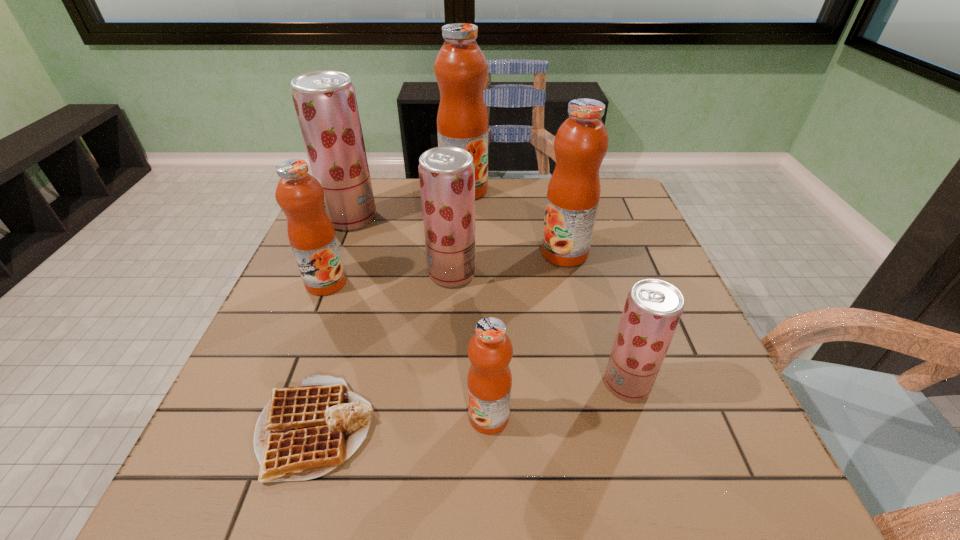
Where is `vacant region located on the front label of the third farthest orange fruit juice`? Image resolution: width=960 pixels, height=540 pixels. vacant region located on the front label of the third farthest orange fruit juice is located at coordinates (313, 316).

You are a GUI agent. You are given a task and a screenshot of the screen. Output one action in this format:
    pyautogui.click(x=<x>, y=<y>)
    Task: Click on the vacant area situated 0.370m on the left of the smallest strawberry fruit juice
    The height and width of the screenshot is (540, 960).
    Given the screenshot: What is the action you would take?
    pyautogui.click(x=404, y=383)

At what (x,y) coordinates should I click in order to perform the action: click on vacant area situated 0.190m on the front label of the nearest orange fruit juice. Please return your answer as a coordinate pair (x, y). The width and height of the screenshot is (960, 540). Looking at the image, I should click on (359, 416).

The image size is (960, 540). What are the coordinates of `free space located on the front label of the nearest orange fruit juice` in the screenshot? It's located at (290, 416).

In order to click on free space located on the front label of the nearest orange fruit juice in this screenshot , I will do `click(365, 416)`.

Locate an element on the screen. free region located on the right of the waffle is located at coordinates (437, 428).

This screenshot has width=960, height=540. What are the coordinates of `object that is at the near edge` in the screenshot? It's located at (304, 432).

I want to click on waffle that is at the left edge, so click(x=304, y=432).

Locate an element on the screen. object that is at the right edge is located at coordinates (653, 308).

The width and height of the screenshot is (960, 540). I want to click on object positioned at the far left corner, so click(x=325, y=102).